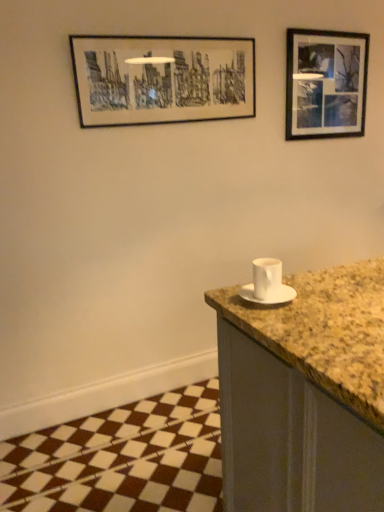
Question: Considering the relative sizes of black matte picture frame at upper right, the 2th picture frame positioned from the left, and black matte picture frame at upper center, marked as the 2th picture frame in a right-to-left arrangement, in the image provided, is black matte picture frame at upper right, the 2th picture frame positioned from the left, smaller than black matte picture frame at upper center, marked as the 2th picture frame in a right-to-left arrangement,?

Choices:
 (A) no
 (B) yes

Answer: (B)

Question: Does black matte picture frame at upper right, the first picture frame viewed from the back, turn towards black matte picture frame at upper center, acting as the 2th picture frame starting from the back?

Choices:
 (A) no
 (B) yes

Answer: (A)

Question: From the image's perspective, is black matte picture frame at upper right, marked as the first picture frame in a right-to-left arrangement, under black matte picture frame at upper center, marked as the 2th picture frame in a right-to-left arrangement?

Choices:
 (A) no
 (B) yes

Answer: (A)

Question: Is black matte picture frame at upper right, the first picture frame viewed from the back, to the right of black matte picture frame at upper center, which is the 1th picture frame from front to back, from the viewer's perspective?

Choices:
 (A) no
 (B) yes

Answer: (B)

Question: Does black matte picture frame at upper right, the 2th picture frame positioned from the left, have a lesser height compared to black matte picture frame at upper center, which is the first picture frame in left-to-right order?

Choices:
 (A) yes
 (B) no

Answer: (B)

Question: Considering the relative positions of black matte picture frame at upper right, the 2th picture frame positioned from the left, and black matte picture frame at upper center, marked as the 2th picture frame in a right-to-left arrangement, in the image provided, is black matte picture frame at upper right, the 2th picture frame positioned from the left, behind black matte picture frame at upper center, marked as the 2th picture frame in a right-to-left arrangement,?

Choices:
 (A) no
 (B) yes

Answer: (B)

Question: From the image's perspective, is white matte saucer at right beneath white ceramic cup at right?

Choices:
 (A) yes
 (B) no

Answer: (A)

Question: Does white matte saucer at right come behind white ceramic cup at right?

Choices:
 (A) no
 (B) yes

Answer: (B)

Question: Considering the relative sizes of white matte saucer at right and white ceramic cup at right in the image provided, is white matte saucer at right thinner than white ceramic cup at right?

Choices:
 (A) no
 (B) yes

Answer: (A)

Question: Is white matte saucer at right positioned with its back to white ceramic cup at right?

Choices:
 (A) yes
 (B) no

Answer: (B)

Question: From a real-world perspective, is white matte saucer at right below white ceramic cup at right?

Choices:
 (A) yes
 (B) no

Answer: (A)

Question: Could you tell me if white matte saucer at right is turned towards white ceramic cup at right?

Choices:
 (A) no
 (B) yes

Answer: (A)

Question: From a real-world perspective, is black matte picture frame at upper center, acting as the 2th picture frame starting from the back, positioned under white ceramic cup at right based on gravity?

Choices:
 (A) yes
 (B) no

Answer: (B)